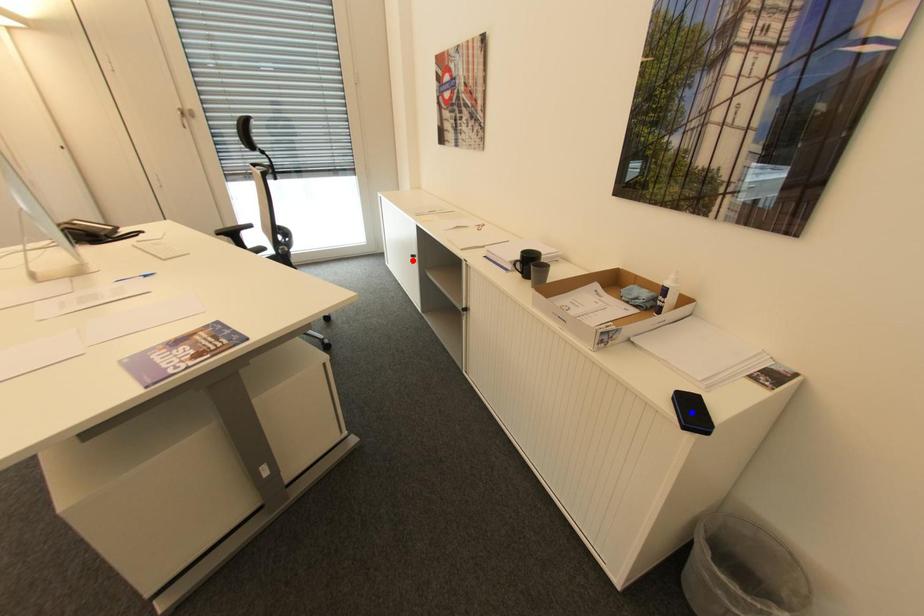
Question: In the image, two points are highlighted. Which point is nearer to the camera? Reply with the corresponding letter.

Choices:
 (A) blue point
 (B) red point

Answer: (A)